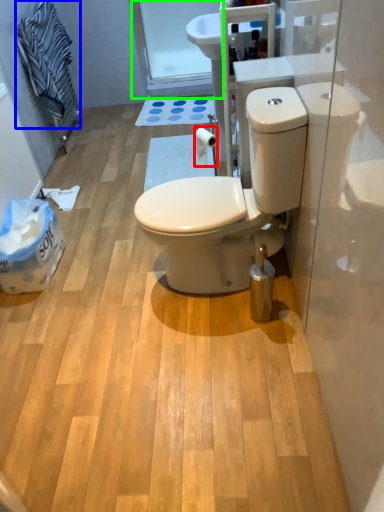
Question: Based on their relative distances, which object is farther from toilet paper (highlighted by a red box)? Choose from laundry (highlighted by a blue box) and glass door (highlighted by a green box).

Choices:
 (A) laundry
 (B) glass door

Answer: (B)